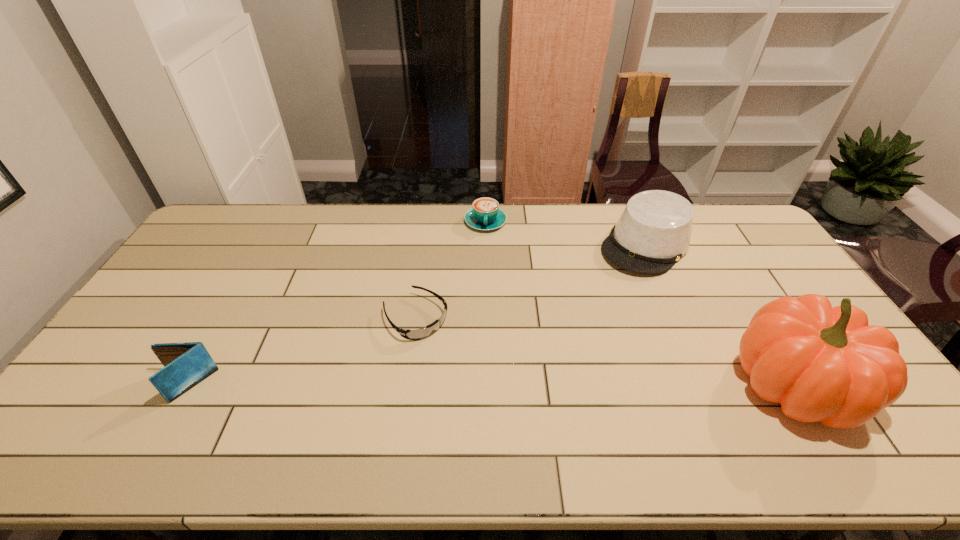
Identify the location of wallet. This screenshot has width=960, height=540. (186, 364).

Image resolution: width=960 pixels, height=540 pixels. Identify the location of the leftmost object. (186, 364).

Locate an element on the screen. the tallest object is located at coordinates (825, 364).

In order to click on the shortest object in this screenshot , I will do `click(417, 334)`.

Locate an element on the screen. sunglasses is located at coordinates (417, 334).

Locate an element on the screen. the second tallest object is located at coordinates [653, 232].

The image size is (960, 540). Identify the location of the third object from left to right. (485, 214).

Locate an element on the screen. The height and width of the screenshot is (540, 960). cappuccino is located at coordinates (485, 214).

Identify the location of free space located 0.100m on the exterior surface of the third shortest object. (x=121, y=386).

Where is `free space located 0.060m on the exterior surface of the third shortest object`? free space located 0.060m on the exterior surface of the third shortest object is located at coordinates (x=136, y=386).